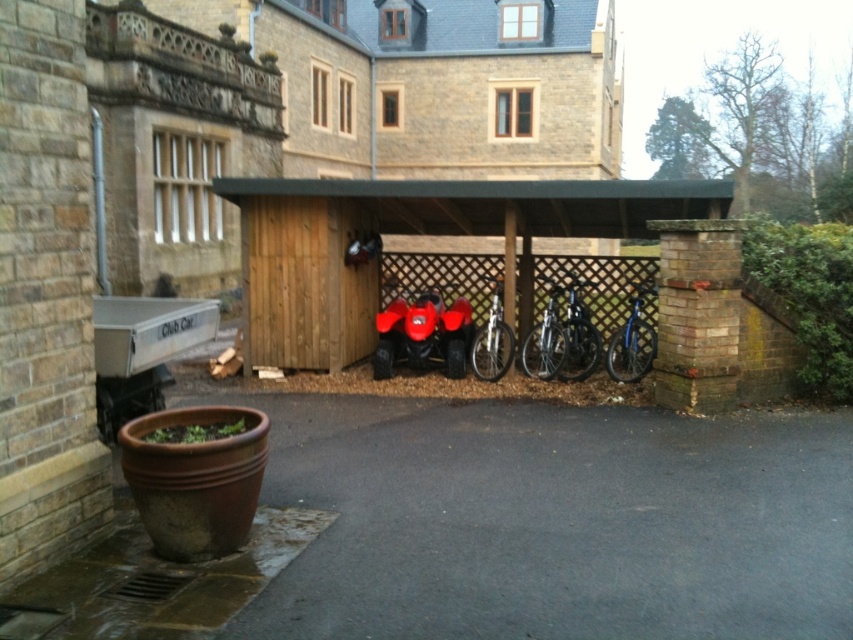
Looking at this image, is shiny black bicycle at center wider than shiny metallic bicycle at center?

Correct, the width of shiny black bicycle at center exceeds that of shiny metallic bicycle at center.

Is point (595, 285) closer to viewer compared to point (502, 376)?

No.

The width and height of the screenshot is (853, 640). I want to click on shiny black bicycle at center, so click(x=579, y=333).

Where is `shiny black bicycle at center`? The height and width of the screenshot is (640, 853). shiny black bicycle at center is located at coordinates (579, 333).

Who is more distant from viewer, (x=639, y=339) or (x=494, y=352)?

Positioned behind is point (x=639, y=339).

Can you confirm if blue metallic bicycle at center-right is positioned to the left of shiny metallic bicycle at center?

In fact, blue metallic bicycle at center-right is to the right of shiny metallic bicycle at center.

Locate an element on the screen. blue metallic bicycle at center-right is located at coordinates (631, 340).

Identify the location of blue metallic bicycle at center-right. (631, 340).

Is blue metallic bicycle at center-right to the left of silver metallic bicycle at center from the viewer's perspective?

In fact, blue metallic bicycle at center-right is to the right of silver metallic bicycle at center.

Can you confirm if blue metallic bicycle at center-right is positioned above silver metallic bicycle at center?

No, blue metallic bicycle at center-right is not above silver metallic bicycle at center.

Between point (631, 326) and point (547, 368), which one is positioned behind?

Positioned behind is point (547, 368).

Image resolution: width=853 pixels, height=640 pixels. I want to click on blue metallic bicycle at center-right, so click(631, 340).